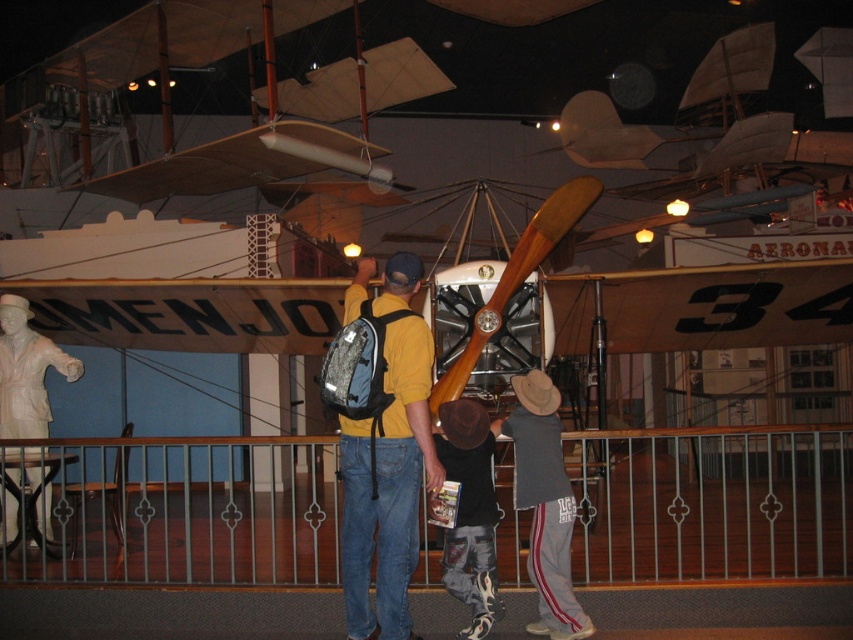
Does gray cotton shirt at lower center have a greater height compared to white marble statue at lower left?

Indeed, gray cotton shirt at lower center has a greater height compared to white marble statue at lower left.

Is gray cotton shirt at lower center to the left of white marble statue at lower left from the viewer's perspective?

In fact, gray cotton shirt at lower center is to the right of white marble statue at lower left.

Where is `gray cotton shirt at lower center`? gray cotton shirt at lower center is located at coordinates tap(544, 502).

Which is above, metal/rail at center or gray cotton shirt at lower center?

gray cotton shirt at lower center is higher up.

Who is lower down, metal/rail at center or gray cotton shirt at lower center?

metal/rail at center is below.

Does point (294, 536) come closer to viewer compared to point (525, 477)?

No, (294, 536) is behind (525, 477).

Where is `metal/rail at center`? The height and width of the screenshot is (640, 853). metal/rail at center is located at coordinates (712, 502).

Does matte yellow shirt at center appear under gray cotton shirt at lower center?

Actually, matte yellow shirt at center is above gray cotton shirt at lower center.

Does matte yellow shirt at center have a lesser width compared to gray cotton shirt at lower center?

Incorrect, matte yellow shirt at center's width is not less than gray cotton shirt at lower center's.

You are a GUI agent. You are given a task and a screenshot of the screen. Output one action in this format:
    pyautogui.click(x=<x>, y=<y>)
    Task: Click on the matte yellow shirt at center
    
    Given the screenshot: What is the action you would take?
    pyautogui.click(x=387, y=486)

At what (x,y) coordinates should I click in order to perform the action: click on matte yellow shirt at center. Please return your answer as a coordinate pair (x, y). This screenshot has width=853, height=640. Looking at the image, I should click on pos(387,486).